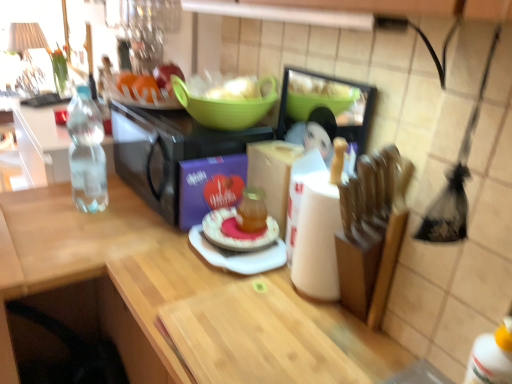
Question: From a real-world perspective, is pink glossy plate at center located higher than green plastic bowl at upper center?

Choices:
 (A) no
 (B) yes

Answer: (A)

Question: Can you confirm if pink glossy plate at center is bigger than green plastic bowl at upper center?

Choices:
 (A) no
 (B) yes

Answer: (A)

Question: Can you confirm if pink glossy plate at center is taller than green plastic bowl at upper center?

Choices:
 (A) no
 (B) yes

Answer: (A)

Question: Can green plastic bowl at upper center be found inside pink glossy plate at center?

Choices:
 (A) no
 (B) yes

Answer: (A)

Question: Would you consider pink glossy plate at center to be distant from green plastic bowl at upper center?

Choices:
 (A) no
 (B) yes

Answer: (A)

Question: Is pink glossy plate at center shorter than green plastic bowl at upper center?

Choices:
 (A) yes
 (B) no

Answer: (A)

Question: Considering the relative positions of wooden cutting board at center, acting as the first appliance starting from the right, and wooden cutting board at center in the image provided, is wooden cutting board at center, acting as the first appliance starting from the right, behind wooden cutting board at center?

Choices:
 (A) no
 (B) yes

Answer: (B)

Question: Is wooden cutting board at center, acting as the first appliance starting from the right, turned away from wooden cutting board at center?

Choices:
 (A) yes
 (B) no

Answer: (B)

Question: Is wooden cutting board at center, acting as the second appliance starting from the left, closer to camera compared to wooden cutting board at center?

Choices:
 (A) no
 (B) yes

Answer: (A)

Question: Is wooden cutting board at center, acting as the second appliance starting from the left, to the right of wooden cutting board at center from the viewer's perspective?

Choices:
 (A) no
 (B) yes

Answer: (B)

Question: From a real-world perspective, is wooden cutting board at center, acting as the second appliance starting from the left, located beneath wooden cutting board at center?

Choices:
 (A) no
 (B) yes

Answer: (A)

Question: From a real-world perspective, is black matte microwave at center, which is the second appliance in right-to-left order, under green plastic bowl at upper center?

Choices:
 (A) no
 (B) yes

Answer: (B)